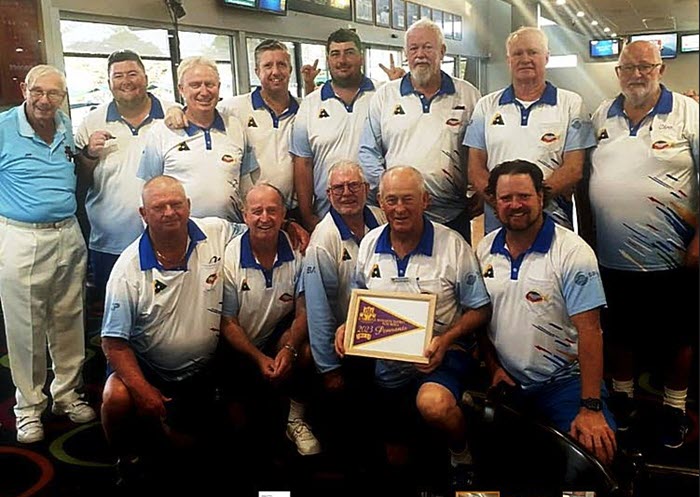
Locate an element on the screen. carpet is located at coordinates (48, 471).